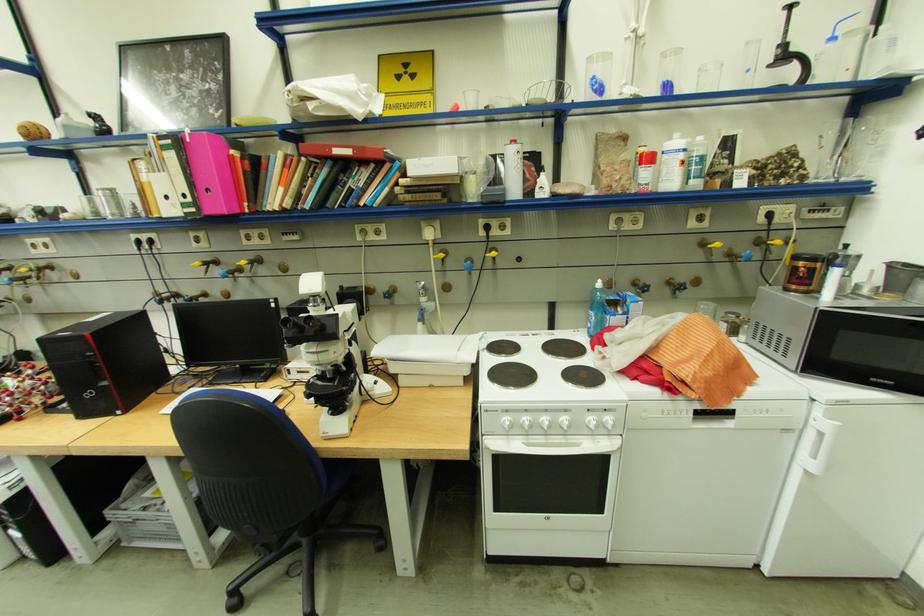
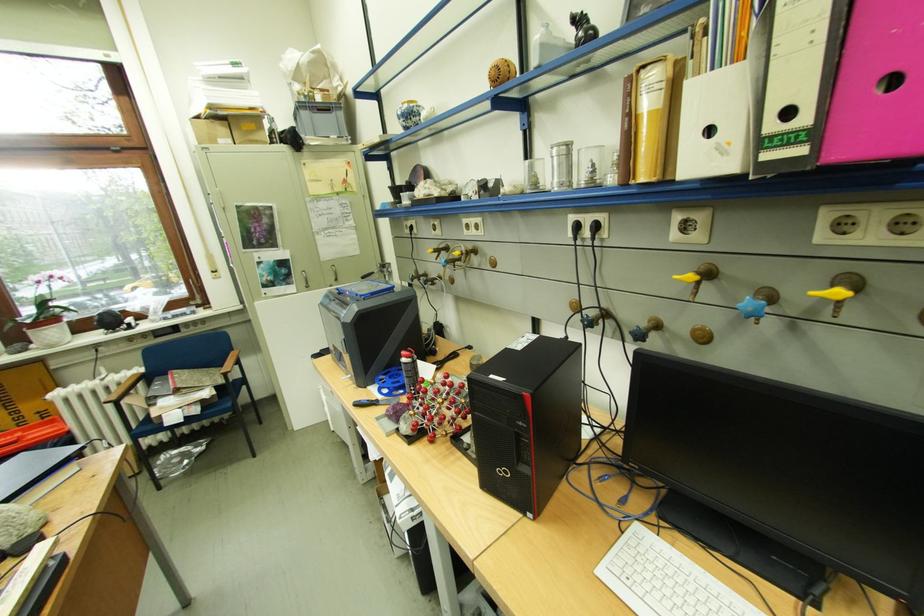
Locate, in the second image, the point that corresponds to point 180,362 in the first image.

(593, 421)